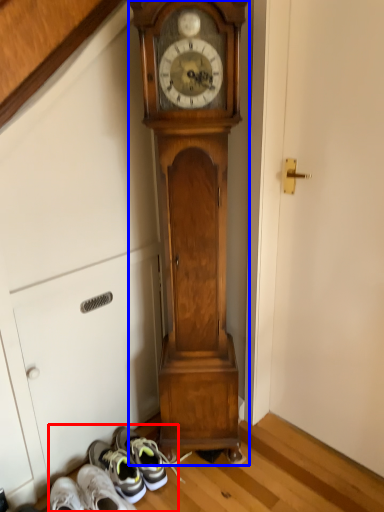
Question: Which object appears closest to the camera in this image, shoe (highlighted by a red box) or wall clock (highlighted by a blue box)?

Choices:
 (A) shoe
 (B) wall clock

Answer: (B)